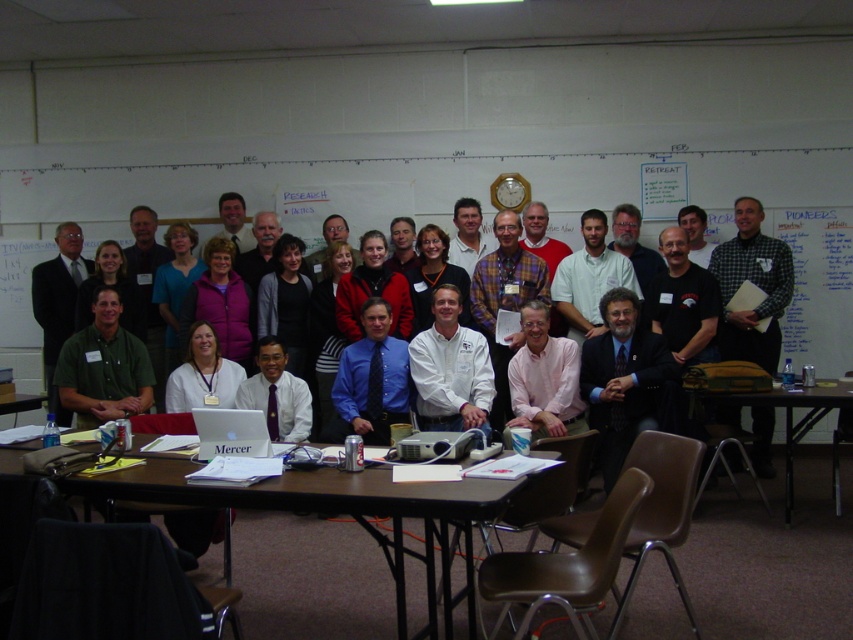
You are organizing a photo shoot in this classroom. You have a camera that can only focus on objects wider than 30 cm. You need to decide whether the white matte shirt at center and the silver metallic laptop at center will be in focus. Which object is wider?

The white matte shirt at center is wider than the silver metallic laptop at center, so the camera will focus on the white matte shirt at center since it exceeds the 30 cm width requirement.

You are a photographer standing at the back of the room. You want to capture a photo where both the white matte shirt at center and the blue dress shirt at center are clearly visible. Given that your camera has a depth of field that can focus on objects within 10 inches of each other, will both shirts be in focus?

The white matte shirt at center is 10.19 inches away from the blue dress shirt at center. Since the distance between them exceeds the camera lens depth of field limit of 10 inches, the camera cannot keep both shirts in focus simultaneously.